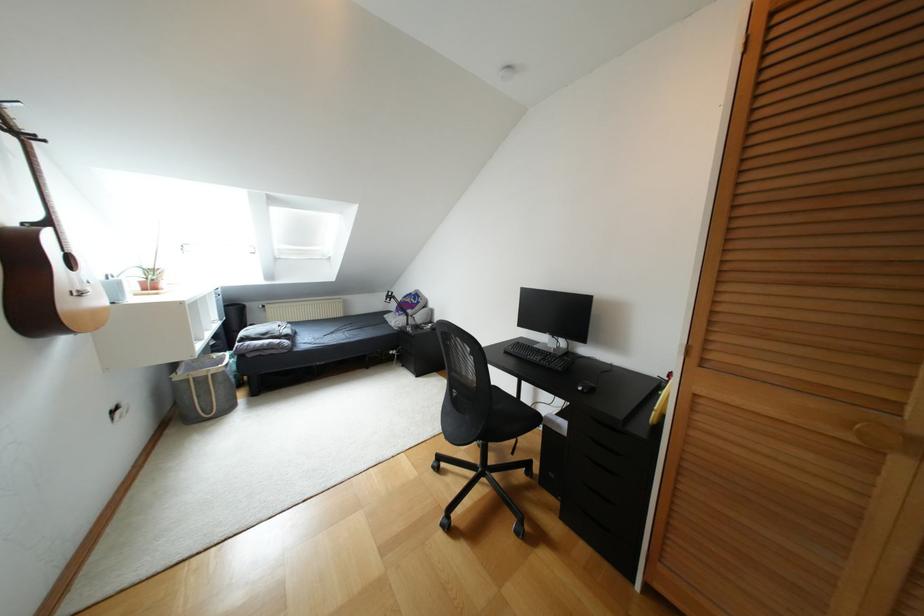
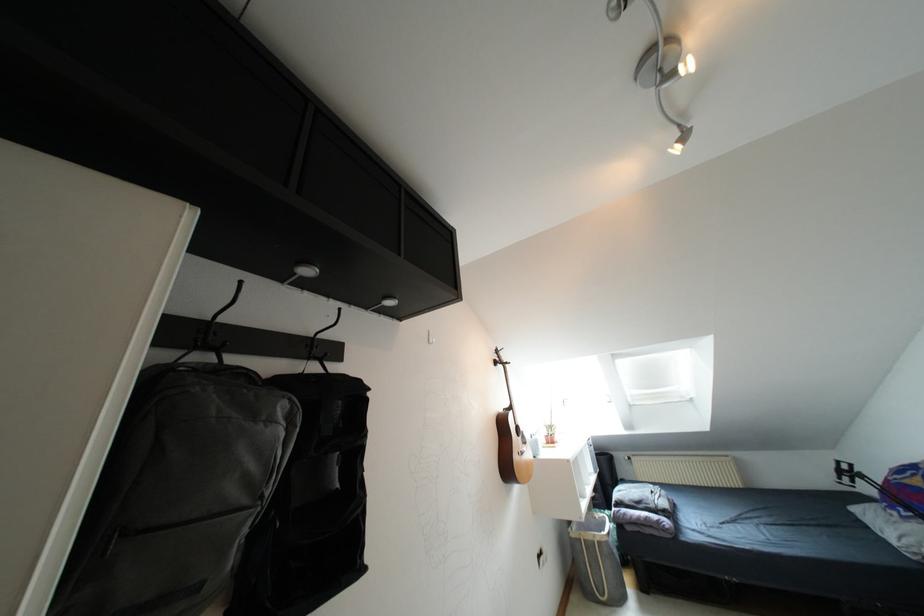
The point at (x=151, y=286) is marked in the first image. Where is the corresponding point in the second image?

(550, 440)